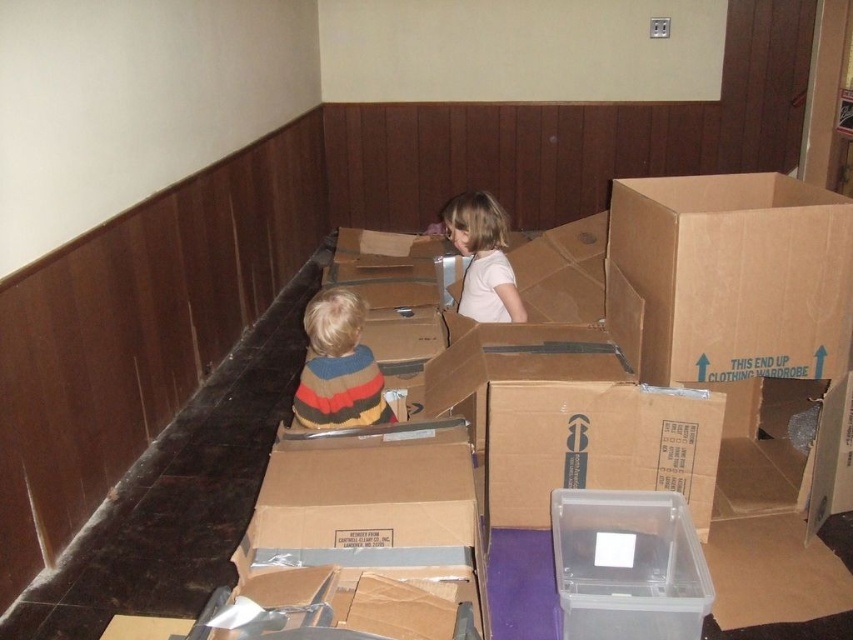
Question: Can you confirm if brown cardboard box at upper right is positioned above striped sweater at center?

Choices:
 (A) yes
 (B) no

Answer: (A)

Question: In this image, where is striped sweater at center located relative to white matte shirt at center?

Choices:
 (A) right
 (B) left

Answer: (B)

Question: Does brown cardboard box at upper right appear under clear plastic container at center?

Choices:
 (A) no
 (B) yes

Answer: (A)

Question: Which object appears closest to the camera in this image?

Choices:
 (A) striped sweater at center
 (B) white matte shirt at center

Answer: (A)

Question: Which object is closer to the camera taking this photo?

Choices:
 (A) clear plastic container at center
 (B) striped sweater at center
 (C) brown cardboard box at upper right

Answer: (A)

Question: Which object is closer to the camera taking this photo?

Choices:
 (A) white matte shirt at center
 (B) brown cardboard box at upper right

Answer: (B)